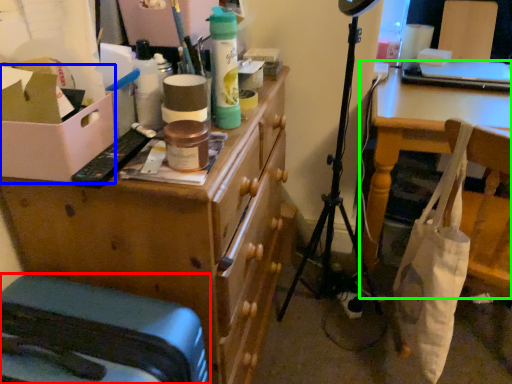
Question: Which object is positioned closest to furniture (highlighted by a red box)? Select from cardboard box (highlighted by a blue box) and table (highlighted by a green box).

Choices:
 (A) cardboard box
 (B) table

Answer: (A)